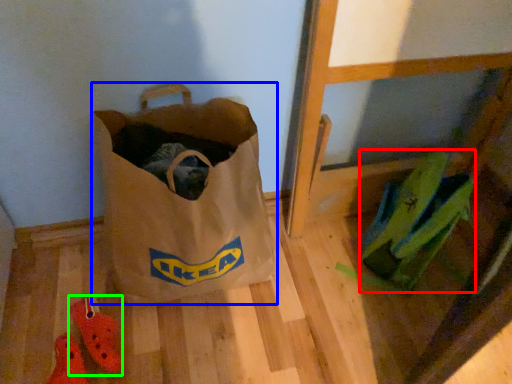
Question: Estimate the real-world distances between objects in this image. Which object is closer to grocery bag (highlighted by a red box), luggage and bags (highlighted by a blue box) or footwear (highlighted by a green box)?

Choices:
 (A) luggage and bags
 (B) footwear

Answer: (A)